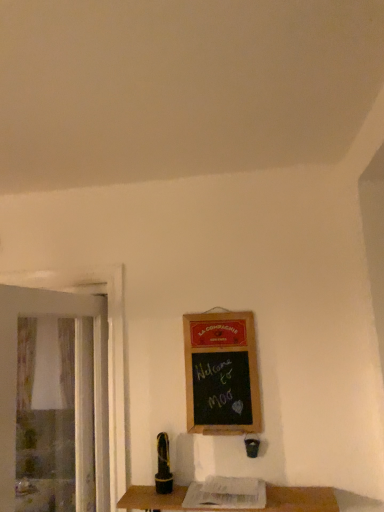
Question: From their relative heights in the image, would you say transparent plastic screen door at left is taller or shorter than wooden table at lower center?

Choices:
 (A) short
 (B) tall

Answer: (B)

Question: From the image's perspective, is transparent plastic screen door at left positioned above or below wooden table at lower center?

Choices:
 (A) below
 (B) above

Answer: (B)

Question: Estimate the real-world distances between objects in this image. Which object is farther from the transparent plastic screen door at left?

Choices:
 (A) wooden table at lower center
 (B) wooden framed chalkboard at center-right

Answer: (A)

Question: Estimate the real-world distances between objects in this image. Which object is farther from the wooden framed chalkboard at center-right?

Choices:
 (A) wooden table at lower center
 (B) transparent plastic screen door at left

Answer: (B)